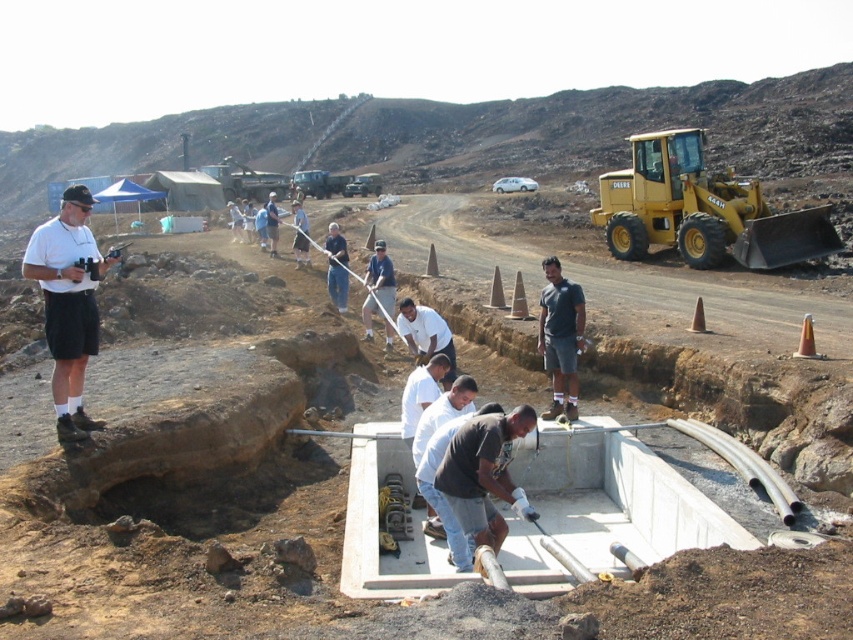
Question: Which object appears farthest from the camera in this image?

Choices:
 (A) white matte shirt at center
 (B) white concrete foundation at center
 (C) white matte shirt at upper left

Answer: (A)

Question: Which of the following is the closest to the observer?

Choices:
 (A) (602, 477)
 (B) (94, 289)
 (C) (554, 285)

Answer: (B)

Question: Observing the image, what is the correct spatial positioning of white concrete foundation at center in reference to yellow rubber tractor at upper right?

Choices:
 (A) below
 (B) above

Answer: (A)

Question: Can you confirm if white concrete basin at center is positioned below white matte shirt at upper left?

Choices:
 (A) no
 (B) yes

Answer: (B)

Question: Observing the image, what is the correct spatial positioning of dark gray shirt at center in reference to white matte shirt at center?

Choices:
 (A) below
 (B) above

Answer: (A)

Question: Among these points, which one is nearest to the camera?

Choices:
 (A) (550, 308)
 (B) (746, 244)
 (C) (376, 252)

Answer: (A)